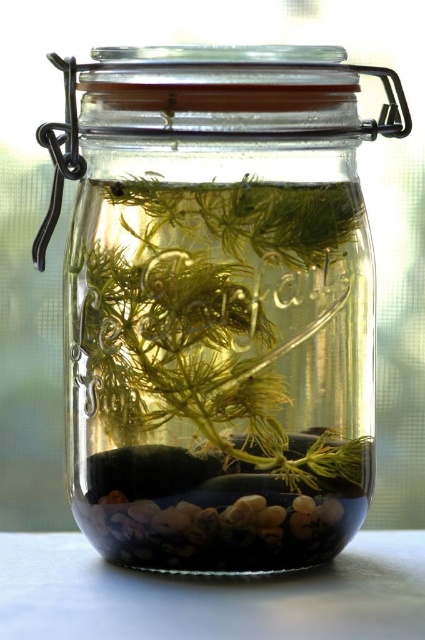
Identify the location of clear glass jar at center. The image size is (425, 640). (218, 301).

Can you confirm if clear glass jar at center is taller than white glossy table at lower center?

Yes, clear glass jar at center is taller than white glossy table at lower center.

Does point (193, 460) lie behind point (119, 636)?

Yes, point (193, 460) is farther from viewer.

At what (x,y) coordinates should I click in order to perform the action: click on clear glass jar at center. Please return your answer as a coordinate pair (x, y). Image resolution: width=425 pixels, height=640 pixels. Looking at the image, I should click on 218,301.

Is translucent green plant at center to the left of white glossy table at lower center from the viewer's perspective?

In fact, translucent green plant at center is to the right of white glossy table at lower center.

Is translucent green plant at center in front of white glossy table at lower center?

No, it is not.

This screenshot has width=425, height=640. What do you see at coordinates (218, 321) in the screenshot? I see `translucent green plant at center` at bounding box center [218, 321].

I want to click on translucent green plant at center, so click(x=218, y=321).

Does clear glass jar at center have a smaller size compared to translucent green plant at center?

Actually, clear glass jar at center might be larger than translucent green plant at center.

Who is shorter, clear glass jar at center or translucent green plant at center?

translucent green plant at center is shorter.

Is point (312, 320) less distant than point (294, 472)?

Yes.

The width and height of the screenshot is (425, 640). What are the coordinates of `clear glass jar at center` in the screenshot? It's located at (218, 301).